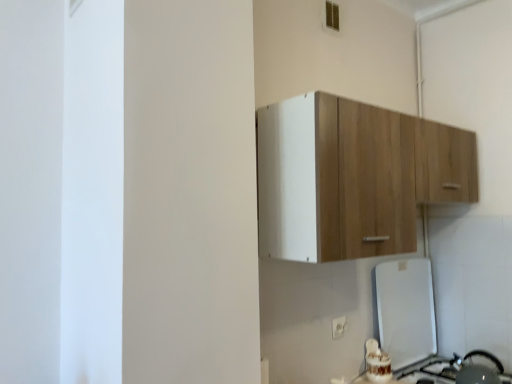
Question: Is wooden cabinet at upper center spatially inside white plastic electric outlet at lower center, or outside of it?

Choices:
 (A) inside
 (B) outside

Answer: (B)

Question: Does point (338, 165) appear closer or farther from the camera than point (337, 321)?

Choices:
 (A) closer
 (B) farther

Answer: (A)

Question: Estimate the real-world distances between objects in this image. Which object is farther from the white plastic electric outlet at lower center?

Choices:
 (A) wooden cabinet at upper center
 (B) metallic silver kettle at lower right, arranged as the 2th appliance when viewed from the top
 (C) white glossy refrigerator at lower right, which is the first appliance from top to bottom

Answer: (A)

Question: Which object is positioned farthest from the wooden cabinet at upper center?

Choices:
 (A) metallic silver kettle at lower right, the 1th appliance from the bottom
 (B) white glossy refrigerator at lower right, acting as the 2th appliance starting from the bottom
 (C) white plastic electric outlet at lower center

Answer: (A)